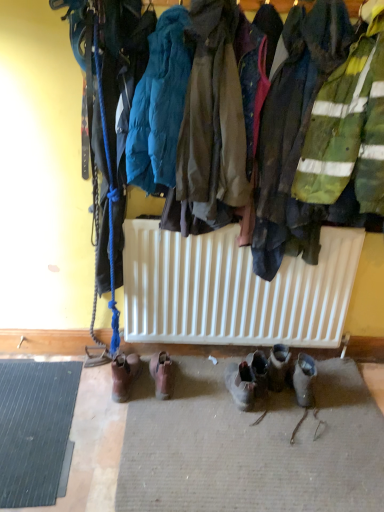
Describe the element at coordinates (213, 117) in the screenshot. I see `brown fabric jacket at center, which is counted as the 1th jacket, starting from the right` at that location.

Where is `brown leather boots at lower center, the 4th footwear from the left`? brown leather boots at lower center, the 4th footwear from the left is located at coordinates (259, 371).

How much space does brown leather boots at lower center, the first footwear in the right-to-left sequence, occupy horizontally?

brown leather boots at lower center, the first footwear in the right-to-left sequence, is 12.36 inches in width.

Locate an element on the screen. brown leather boots at lower center, the 3th footwear from the left is located at coordinates click(x=240, y=384).

In order to face brown leather boots at lower center, the 2th footwear positioned from the right, should I rotate leftwards or rightwards?

You should rotate right by 6.989 degrees.

The image size is (384, 512). What do you see at coordinates (124, 375) in the screenshot?
I see `brown leather boots at lower center, the 4th footwear viewed from the right` at bounding box center [124, 375].

What do you see at coordinates (34, 428) in the screenshot? The image size is (384, 512). I see `black rubber mat at lower left` at bounding box center [34, 428].

This screenshot has width=384, height=512. Identify the location of brown leather boots at center, positioned as the 2th footwear in left-to-right order. (162, 374).

From a real-world perspective, is brown leather boots at center, positioned as the 2th footwear in left-to-right order, located beneath brown fabric jacket at center, which is counted as the 1th jacket, starting from the right?

Indeed, from a real-world perspective, brown leather boots at center, positioned as the 2th footwear in left-to-right order, is positioned beneath brown fabric jacket at center, which is counted as the 1th jacket, starting from the right.

Is brown leather boots at center, placed as the third footwear when sorted from right to left, next to brown fabric jacket at center, the 2th jacket positioned from the left?

No, brown leather boots at center, placed as the third footwear when sorted from right to left, is not with brown fabric jacket at center, the 2th jacket positioned from the left.

How far apart are brown leather boots at center, positioned as the 2th footwear in left-to-right order, and brown fabric jacket at center, the 2th jacket positioned from the left?

brown leather boots at center, positioned as the 2th footwear in left-to-right order, is 3.78 feet away from brown fabric jacket at center, the 2th jacket positioned from the left.

Considering the sizes of objects brown leather boots at center, placed as the third footwear when sorted from right to left, and brown fabric jacket at center, which is counted as the 1th jacket, starting from the right, in the image provided, who is smaller, brown leather boots at center, placed as the third footwear when sorted from right to left, or brown fabric jacket at center, which is counted as the 1th jacket, starting from the right,?

brown leather boots at center, placed as the third footwear when sorted from right to left.

Which object is thinner, brown leather boots at lower center, the 2th footwear positioned from the right, or brown fabric jacket at center, the 2th jacket positioned from the left?

Thinner between the two is brown leather boots at lower center, the 2th footwear positioned from the right.

Does point (247, 410) come in front of point (233, 183)?

No, it is behind (233, 183).

Is brown leather boots at lower center, the 3th footwear from the left, oriented towards brown fabric jacket at center, the 2th jacket positioned from the left?

No, brown leather boots at lower center, the 3th footwear from the left, is not aimed at brown fabric jacket at center, the 2th jacket positioned from the left.

Is teal puffy jacket at upper center, which appears as the first jacket when viewed from the left, thinner than brown leather boots at center, positioned as the 2th footwear in left-to-right order?

Yes.

Is teal puffy jacket at upper center, which appears as the first jacket when viewed from the left, smaller than brown leather boots at center, placed as the third footwear when sorted from right to left?

Actually, teal puffy jacket at upper center, which appears as the first jacket when viewed from the left, might be larger than brown leather boots at center, placed as the third footwear when sorted from right to left.

Considering the positions of points (178, 23) and (152, 366), is point (178, 23) closer to camera compared to point (152, 366)?

Yes, it is.

How distant is teal puffy jacket at upper center, which appears as the first jacket when viewed from the left, from brown leather boots at center, positioned as the 2th footwear in left-to-right order?

They are 1.21 meters apart.

Can you tell me how much brown fabric jacket at center, the 2th jacket positioned from the left, and brown leather boots at center, placed as the third footwear when sorted from right to left, differ in facing direction?

The angle between the facing direction of brown fabric jacket at center, the 2th jacket positioned from the left, and the facing direction of brown leather boots at center, placed as the third footwear when sorted from right to left, is 0.00152 degrees.

Is brown fabric jacket at center, which is counted as the 1th jacket, starting from the right, at the left side of brown leather boots at center, placed as the third footwear when sorted from right to left?

No.

From a real-world perspective, is brown fabric jacket at center, which is counted as the 1th jacket, starting from the right, on brown leather boots at center, placed as the third footwear when sorted from right to left?

Yes, from a real-world perspective, brown fabric jacket at center, which is counted as the 1th jacket, starting from the right, is on top of brown leather boots at center, placed as the third footwear when sorted from right to left.

Can you confirm if brown fabric jacket at center, the 2th jacket positioned from the left, is taller than brown leather boots at center, placed as the third footwear when sorted from right to left?

Correct, brown fabric jacket at center, the 2th jacket positioned from the left, is much taller as brown leather boots at center, placed as the third footwear when sorted from right to left.

Considering the points (111, 367) and (218, 205), which point is in front, point (111, 367) or point (218, 205)?

The point (218, 205) is closer.

Between brown leather boots at lower center, the 4th footwear viewed from the right, and brown fabric jacket at center, the 2th jacket positioned from the left, which one has smaller width?

brown leather boots at lower center, the 4th footwear viewed from the right, is thinner.

Does brown leather boots at lower center, the first footwear in the left-to-right sequence, appear on the left side of brown fabric jacket at center, the 2th jacket positioned from the left?

Correct, you'll find brown leather boots at lower center, the first footwear in the left-to-right sequence, to the left of brown fabric jacket at center, the 2th jacket positioned from the left.

Between brown leather boots at lower center, the 4th footwear viewed from the right, and brown fabric jacket at center, which is counted as the 1th jacket, starting from the right, which one has more height?

With more height is brown fabric jacket at center, which is counted as the 1th jacket, starting from the right.

From a real-world perspective, is brown leather boots at lower center, the 3th footwear from the left, positioned above or below teal puffy jacket at upper center, marked as the second jacket in a right-to-left arrangement?

Clearly, from a real-world perspective, brown leather boots at lower center, the 3th footwear from the left, is below teal puffy jacket at upper center, marked as the second jacket in a right-to-left arrangement.

Considering the sizes of objects brown leather boots at lower center, the 2th footwear positioned from the right, and teal puffy jacket at upper center, which appears as the first jacket when viewed from the left, in the image provided, who is taller, brown leather boots at lower center, the 2th footwear positioned from the right, or teal puffy jacket at upper center, which appears as the first jacket when viewed from the left,?

Standing taller between the two is teal puffy jacket at upper center, which appears as the first jacket when viewed from the left.

Looking at this image, is brown leather boots at lower center, the 2th footwear positioned from the right, beside teal puffy jacket at upper center, marked as the second jacket in a right-to-left arrangement?

No, brown leather boots at lower center, the 2th footwear positioned from the right, is not making contact with teal puffy jacket at upper center, marked as the second jacket in a right-to-left arrangement.

Could you tell me if brown leather boots at lower center, the 3th footwear from the left, is facing teal puffy jacket at upper center, which appears as the first jacket when viewed from the left?

No, brown leather boots at lower center, the 3th footwear from the left, is not oriented towards teal puffy jacket at upper center, which appears as the first jacket when viewed from the left.

Are brown leather boots at center, positioned as the 2th footwear in left-to-right order, and brown leather boots at lower center, the first footwear in the right-to-left sequence, located far from each other?

Actually, brown leather boots at center, positioned as the 2th footwear in left-to-right order, and brown leather boots at lower center, the first footwear in the right-to-left sequence, are a little close together.

From the image's perspective, starting from the brown leather boots at lower center, the 4th footwear from the left, which footwear is the 2nd one above? Please provide its 2D coordinates.

[(162, 374)]

Which of these two, brown leather boots at center, placed as the third footwear when sorted from right to left, or brown leather boots at lower center, the first footwear in the right-to-left sequence, is smaller?

brown leather boots at lower center, the first footwear in the right-to-left sequence, is smaller.

Which is nearer, [172,388] or [252,374]?

Point [172,388]

Find the location of a particular element. the 1st footwear below the brown fabric jacket at center, which is counted as the 1th jacket, starting from the right (from the image's perspective) is located at coordinates (162, 374).

At what (x,y) coordinates should I click in order to perform the action: click on the 1st jacket counting from the left side of the brown leather boots at lower center, the 2th footwear positioned from the right. Please return your answer as a coordinate pair (x, y). The height and width of the screenshot is (512, 384). Looking at the image, I should click on (213, 117).

When comparing their distances from black rubber mat at lower left, does teal puffy jacket at upper center, marked as the second jacket in a right-to-left arrangement, or brown leather boots at lower center, the 2th footwear positioned from the right, seem closer?

brown leather boots at lower center, the 2th footwear positioned from the right.

Which object lies further to the anchor point brown leather boots at lower center, the first footwear in the left-to-right sequence, brown leather boots at lower center, the 2th footwear positioned from the right, or brown leather boots at lower center, the 4th footwear from the left?

The object further to brown leather boots at lower center, the first footwear in the left-to-right sequence, is brown leather boots at lower center, the 4th footwear from the left.

Estimate the real-world distances between objects in this image. Which object is closer to brown fabric jacket at center, the 2th jacket positioned from the left, brown leather boots at lower center, the 2th footwear positioned from the right, or teal puffy jacket at upper center, which appears as the first jacket when viewed from the left?

The object closer to brown fabric jacket at center, the 2th jacket positioned from the left, is teal puffy jacket at upper center, which appears as the first jacket when viewed from the left.

Estimate the real-world distances between objects in this image. Which object is further from brown fabric jacket at center, which is counted as the 1th jacket, starting from the right, teal puffy jacket at upper center, which appears as the first jacket when viewed from the left, or brown leather boots at lower center, the 4th footwear from the left?

Among the two, brown leather boots at lower center, the 4th footwear from the left, is located further to brown fabric jacket at center, which is counted as the 1th jacket, starting from the right.

When comparing their distances from black rubber mat at lower left, does brown leather boots at lower center, the first footwear in the left-to-right sequence, or brown leather boots at center, placed as the third footwear when sorted from right to left, seem further?

brown leather boots at center, placed as the third footwear when sorted from right to left, is positioned further to the anchor black rubber mat at lower left.

Based on their spatial positions, is black rubber mat at lower left or brown fabric jacket at center, the 2th jacket positioned from the left, closer to teal puffy jacket at upper center, marked as the second jacket in a right-to-left arrangement?

Among the two, brown fabric jacket at center, the 2th jacket positioned from the left, is located nearer to teal puffy jacket at upper center, marked as the second jacket in a right-to-left arrangement.

Estimate the real-world distances between objects in this image. Which object is further from brown leather boots at lower center, the 3th footwear from the left, black rubber mat at lower left or brown leather boots at lower center, the 4th footwear viewed from the right?

black rubber mat at lower left lies further to brown leather boots at lower center, the 3th footwear from the left, than the other object.

Considering their positions, is brown leather boots at lower center, the 4th footwear viewed from the right, positioned closer to brown leather boots at lower center, the first footwear in the right-to-left sequence, than brown leather boots at lower center, the 2th footwear positioned from the right?

The object closer to brown leather boots at lower center, the first footwear in the right-to-left sequence, is brown leather boots at lower center, the 2th footwear positioned from the right.

The width and height of the screenshot is (384, 512). Identify the location of footwear situated between brown leather boots at center, positioned as the 2th footwear in left-to-right order, and brown leather boots at lower center, the 4th footwear from the left, from left to right. (240, 384).

The image size is (384, 512). I want to click on footwear located between brown leather boots at lower center, the 4th footwear viewed from the right, and brown leather boots at lower center, the 2th footwear positioned from the right, in the left-right direction, so click(162, 374).

Where is `jacket between teal puffy jacket at upper center, marked as the second jacket in a right-to-left arrangement, and brown leather boots at lower center, the first footwear in the right-to-left sequence, from top to bottom`? Image resolution: width=384 pixels, height=512 pixels. jacket between teal puffy jacket at upper center, marked as the second jacket in a right-to-left arrangement, and brown leather boots at lower center, the first footwear in the right-to-left sequence, from top to bottom is located at coordinates [x=213, y=117].

Locate an element on the screen. The height and width of the screenshot is (512, 384). jacket between teal puffy jacket at upper center, which appears as the first jacket when viewed from the left, and black rubber mat at lower left in the up-down direction is located at coordinates (213, 117).